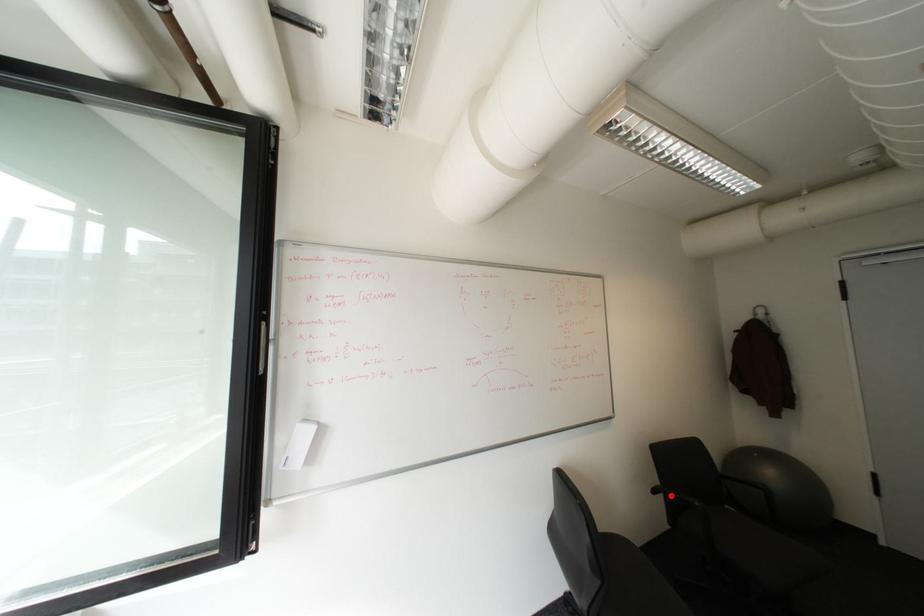
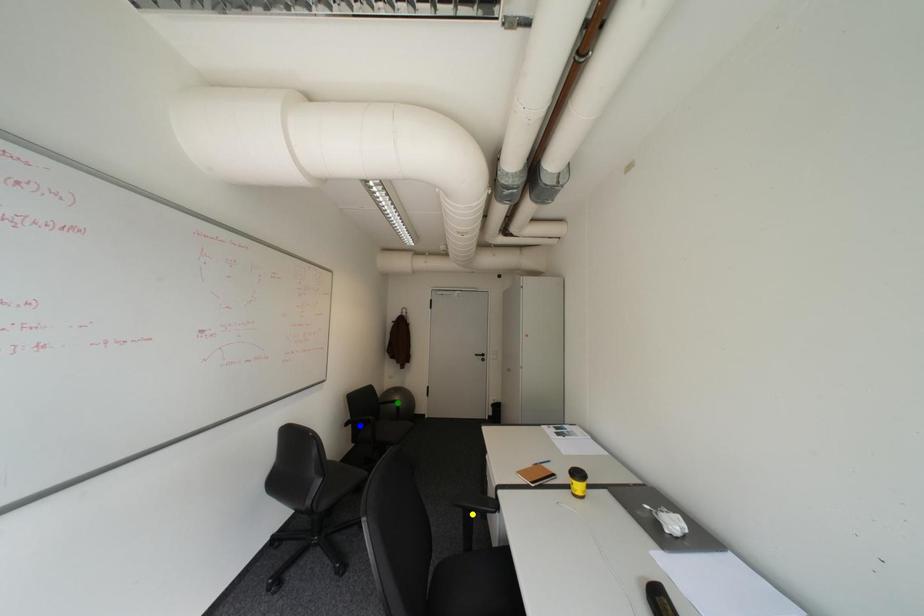
Question: I am providing you with two images of the same scene from different viewpoints. A red point is marked on the first image. You are given multiple points on the second image. Which mark in image 2 goes with the point in image 1?

Choices:
 (A) yellow point
 (B) blue point
 (C) green point

Answer: (B)